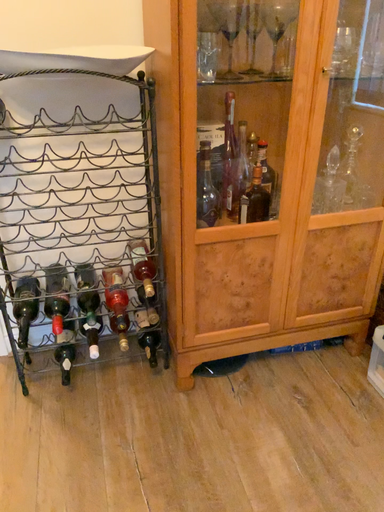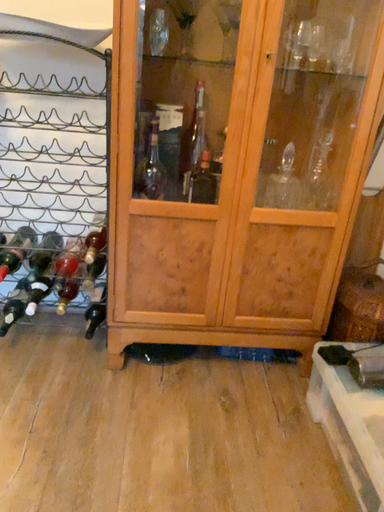
Question: How did the camera likely rotate when shooting the video?

Choices:
 (A) rotated right
 (B) rotated left

Answer: (B)